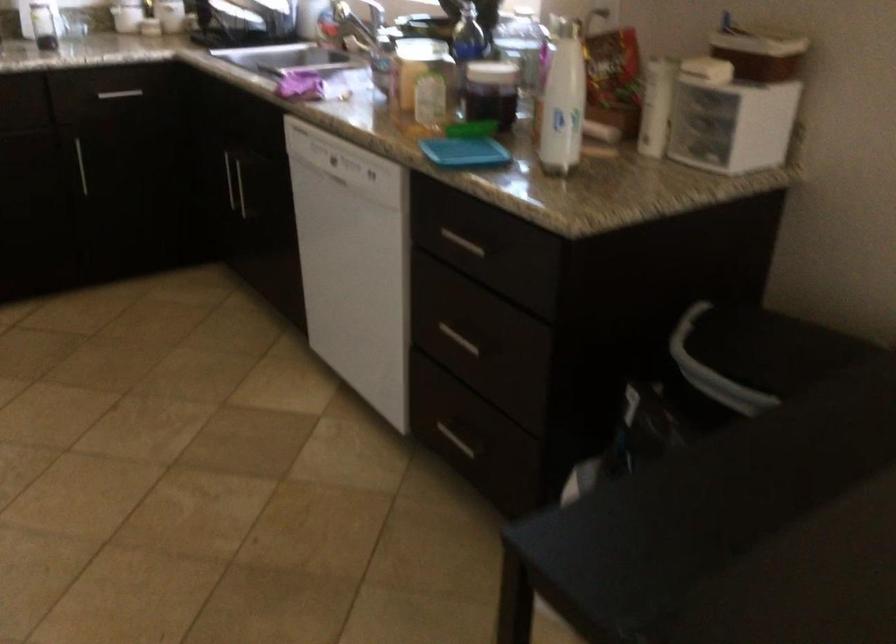
The location [299,84] corresponds to which object?

It corresponds to the purple jam jar in the image.